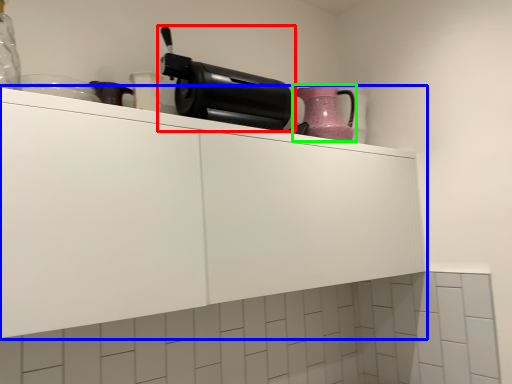
Question: Based on their relative distances, which object is nearer to home appliance (highlighted by a red box)? Choose from cabinetry (highlighted by a blue box) and kitchen appliance (highlighted by a green box).

Choices:
 (A) cabinetry
 (B) kitchen appliance

Answer: (B)